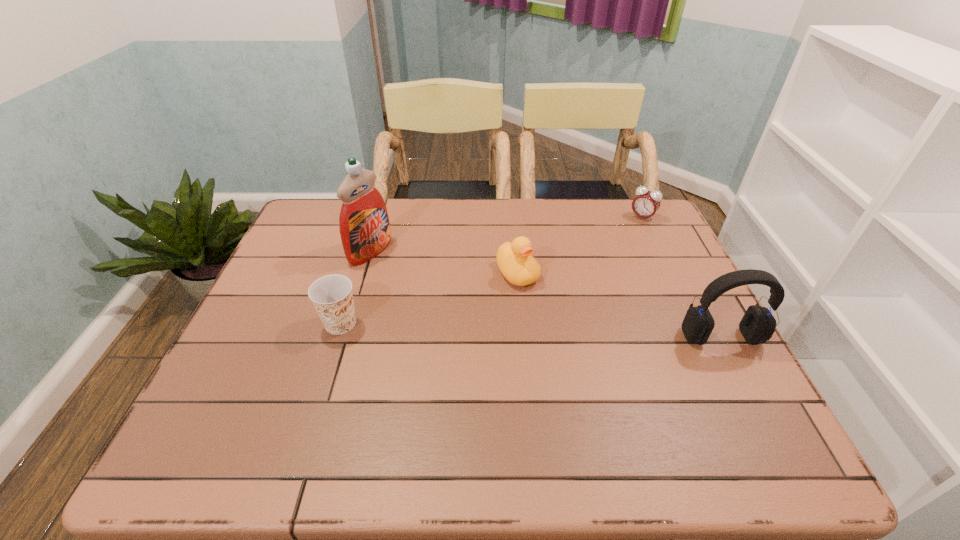
Locate an element on the screen. vacant region located on the clock face of the farthest object is located at coordinates coord(625,238).

You are a GUI agent. You are given a task and a screenshot of the screen. Output one action in this format:
    pyautogui.click(x=<x>, y=<y>)
    Task: Click on the free spot located on the clock face of the farthest object
    
    Given the screenshot: What is the action you would take?
    pyautogui.click(x=607, y=262)

Find the location of a particular element. The width and height of the screenshot is (960, 540). vacant position located 0.330m on the clock face of the farthest object is located at coordinates (593, 280).

Where is `free space located 0.190m on the front surface of the detergent`? This screenshot has height=540, width=960. free space located 0.190m on the front surface of the detergent is located at coordinates (437, 285).

This screenshot has height=540, width=960. In order to click on free space located on the front surface of the detergent in this screenshot , I will do `click(455, 294)`.

The width and height of the screenshot is (960, 540). I want to click on free region located on the front surface of the detergent, so click(406, 270).

The image size is (960, 540). I want to click on alarm clock positioned at the far edge, so (646, 203).

In order to click on detergent present at the far edge in this screenshot , I will do `click(364, 226)`.

The image size is (960, 540). In order to click on headset that is at the right edge in this screenshot , I will do `click(758, 324)`.

Locate an element on the screen. The height and width of the screenshot is (540, 960). alarm clock present at the right edge is located at coordinates (646, 203).